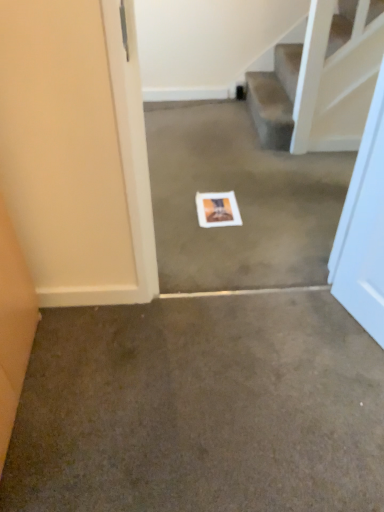
Question: From the image's perspective, is brown carpet at center, placed as the second concrete when sorted from top to bottom, located above white matte postcard at center?

Choices:
 (A) yes
 (B) no

Answer: (B)

Question: Is there a large distance between brown carpet at center, the 1th concrete from the bottom, and white matte postcard at center?

Choices:
 (A) yes
 (B) no

Answer: (B)

Question: Would you say brown carpet at center, the 1th concrete viewed from the front, is outside white matte postcard at center?

Choices:
 (A) yes
 (B) no

Answer: (A)

Question: From a real-world perspective, is brown carpet at center, the 1th concrete viewed from the front, on white matte postcard at center?

Choices:
 (A) yes
 (B) no

Answer: (B)

Question: Is white matte postcard at center inside brown carpet at center, the 1th concrete viewed from the front?

Choices:
 (A) yes
 (B) no

Answer: (B)

Question: Is brown carpet at center, arranged as the 2th concrete when viewed from the back, at the left side of white matte postcard at center?

Choices:
 (A) yes
 (B) no

Answer: (A)

Question: Considering the relative sizes of white paper at center, positioned as the first concrete in back-to-front order, and white matte postcard at center in the image provided, is white paper at center, positioned as the first concrete in back-to-front order, smaller than white matte postcard at center?

Choices:
 (A) yes
 (B) no

Answer: (B)

Question: Does white paper at center, the second concrete when ordered from front to back, appear on the left side of white matte postcard at center?

Choices:
 (A) no
 (B) yes

Answer: (A)

Question: Does white paper at center, positioned as the first concrete in back-to-front order, have a lesser height compared to white matte postcard at center?

Choices:
 (A) yes
 (B) no

Answer: (B)

Question: Does white paper at center, the second concrete when ordered from front to back, have a lesser width compared to white matte postcard at center?

Choices:
 (A) no
 (B) yes

Answer: (A)

Question: Does white paper at center, which is the first concrete in top-to-bottom order, appear on the right side of white matte postcard at center?

Choices:
 (A) no
 (B) yes

Answer: (B)

Question: Does white paper at center, which is the first concrete in top-to-bottom order, have a larger size compared to white matte postcard at center?

Choices:
 (A) yes
 (B) no

Answer: (A)

Question: Is white matte postcard at center facing towards brown carpet at center, the 1th concrete viewed from the front?

Choices:
 (A) yes
 (B) no

Answer: (A)